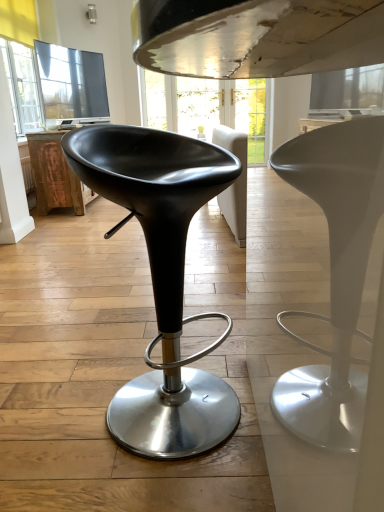
Question: Are black leather stool at center and rustic wood table at left located far from each other?

Choices:
 (A) yes
 (B) no

Answer: (A)

Question: Is black leather stool at center behind rustic wood table at left?

Choices:
 (A) no
 (B) yes

Answer: (A)

Question: From a real-world perspective, is black leather stool at center under rustic wood table at left?

Choices:
 (A) no
 (B) yes

Answer: (A)

Question: Is black leather stool at center thinner than rustic wood table at left?

Choices:
 (A) no
 (B) yes

Answer: (B)

Question: From the image's perspective, would you say black leather stool at center is positioned over rustic wood table at left?

Choices:
 (A) yes
 (B) no

Answer: (B)

Question: Could you tell me if black leather stool at center is facing rustic wood table at left?

Choices:
 (A) yes
 (B) no

Answer: (B)

Question: Considering the relative sizes of rustic wood table at left and black leather stool at center in the image provided, is rustic wood table at left wider than black leather stool at center?

Choices:
 (A) no
 (B) yes

Answer: (B)

Question: Considering the relative sizes of rustic wood table at left and black leather stool at center in the image provided, is rustic wood table at left taller than black leather stool at center?

Choices:
 (A) yes
 (B) no

Answer: (B)

Question: Considering the relative sizes of rustic wood table at left and black leather stool at center in the image provided, is rustic wood table at left bigger than black leather stool at center?

Choices:
 (A) yes
 (B) no

Answer: (A)

Question: From a real-world perspective, is rustic wood table at left located beneath black leather stool at center?

Choices:
 (A) yes
 (B) no

Answer: (A)

Question: From a real-world perspective, is rustic wood table at left over black leather stool at center?

Choices:
 (A) yes
 (B) no

Answer: (B)

Question: Can you confirm if rustic wood table at left is positioned to the right of black leather stool at center?

Choices:
 (A) no
 (B) yes

Answer: (A)

Question: Does point (188, 187) appear closer or farther from the camera than point (39, 202)?

Choices:
 (A) closer
 (B) farther

Answer: (A)